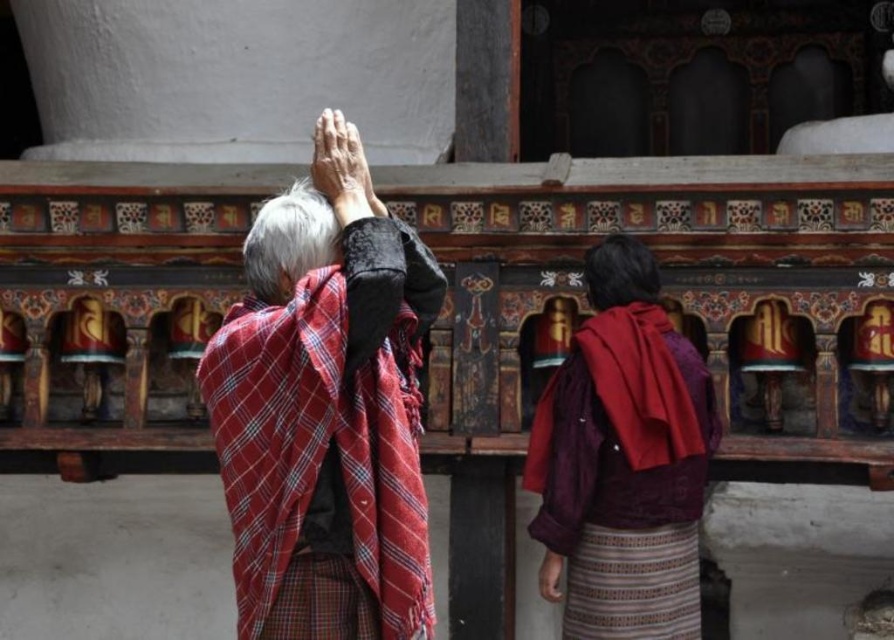
Between point (260, 317) and point (593, 420), which one is positioned behind?

The point (593, 420) is behind.

Does red plaid shawl at center appear under maroon textured shawl at center?

Incorrect, red plaid shawl at center is not positioned below maroon textured shawl at center.

Where is `red plaid shawl at center`? Image resolution: width=894 pixels, height=640 pixels. red plaid shawl at center is located at coordinates (329, 438).

Find the location of `red plaid shawl at center`. red plaid shawl at center is located at coordinates (329, 438).